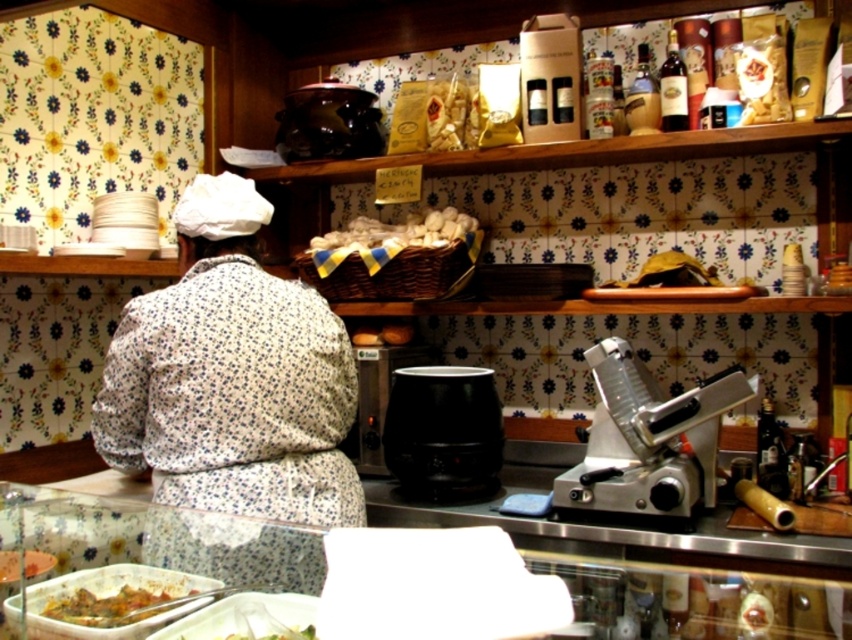
Based on the photo, you are a customer in this Italian kitchen and want to know which item is larger between the white floral apron at center and the green leafy vegetable at lower center. Can you tell me?

The white floral apron at center is bigger than the green leafy vegetable at lower center.

Where is the white floral apron at center located in the scene?

The white floral apron at center is located at point (232,403) in the scene.